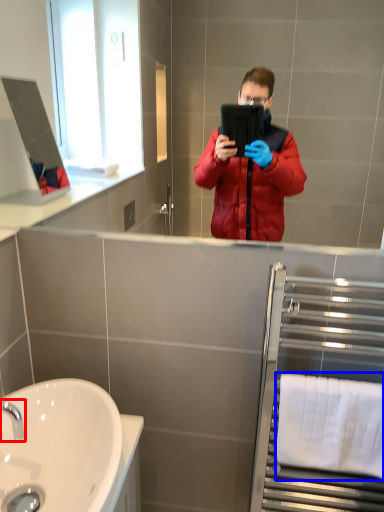
Question: Which object is further to the camera taking this photo, tap (highlighted by a red box) or towel bar (highlighted by a blue box)?

Choices:
 (A) tap
 (B) towel bar

Answer: (B)